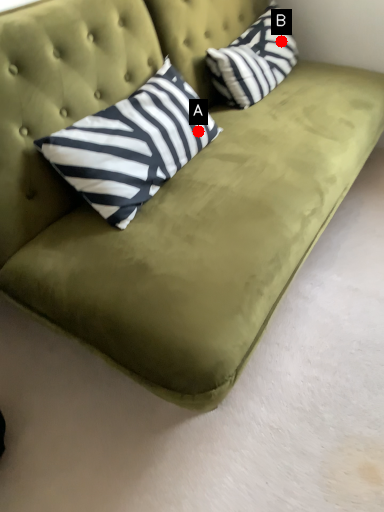
Question: Two points are circled on the image, labeled by A and B beside each circle. Among these points, which one is nearest to the camera?

Choices:
 (A) A is closer
 (B) B is closer

Answer: (A)